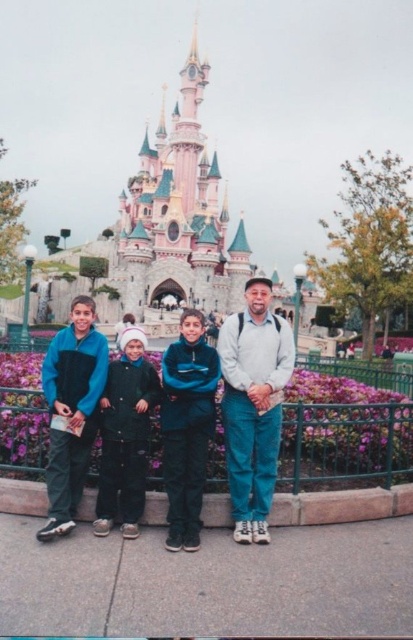
Question: Which point is closer to the camera?

Choices:
 (A) light gray sweater at center
 (B) blue fleece jacket at center

Answer: (B)

Question: Can you confirm if blue fleece jacket at center is thinner than light gray sweater at center?

Choices:
 (A) no
 (B) yes

Answer: (A)

Question: Can you confirm if blue fleece jacket at center is positioned above light gray sweater at center?

Choices:
 (A) yes
 (B) no

Answer: (B)

Question: Is blue fleece jacket at center closer to the viewer compared to light gray sweater at center?

Choices:
 (A) yes
 (B) no

Answer: (A)